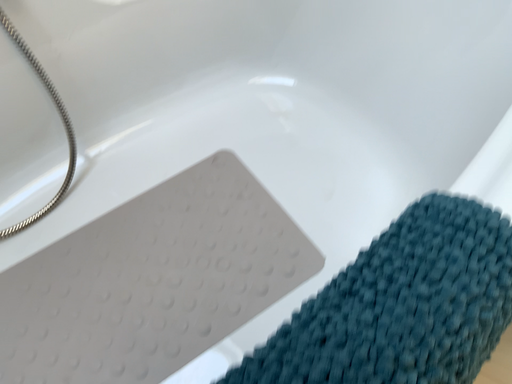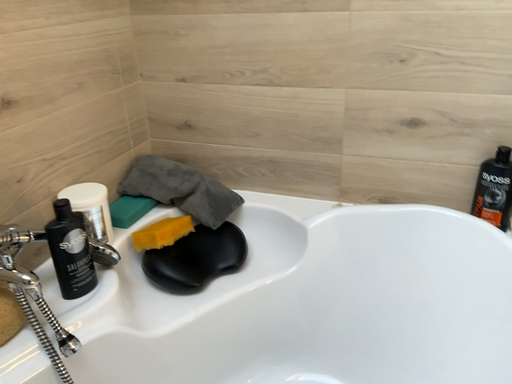
Question: Which way did the camera rotate in the video?

Choices:
 (A) rotated downward
 (B) rotated upward

Answer: (B)